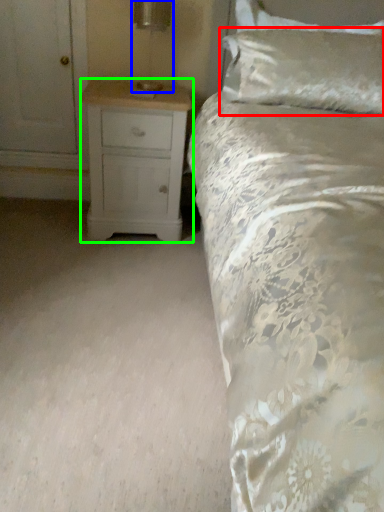
Question: Considering the real-world distances, which object is farthest from pillow (highlighted by a red box)? table lamp (highlighted by a blue box) or chest of drawers (highlighted by a green box)?

Choices:
 (A) table lamp
 (B) chest of drawers

Answer: (A)